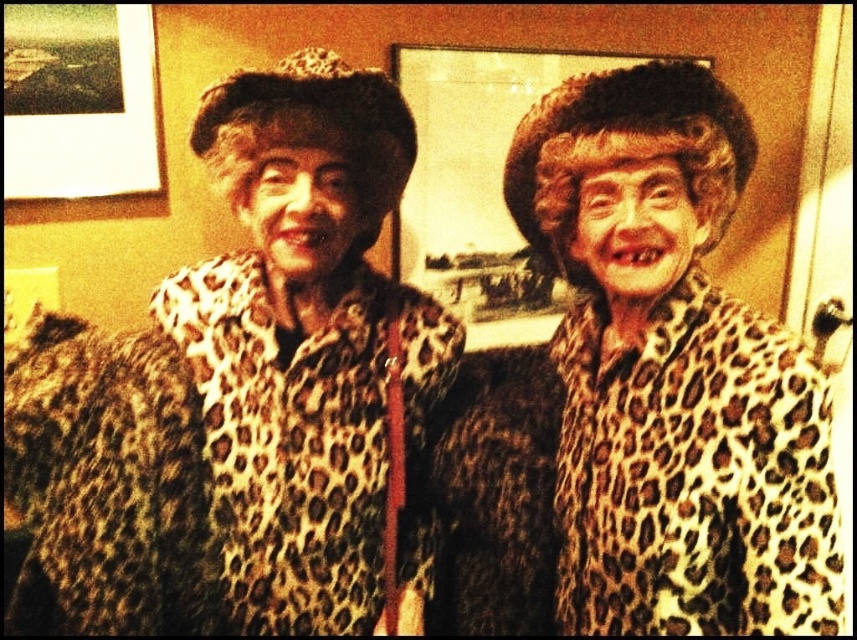
Does leopard print coat at center have a lesser width compared to matte plastic picture frame at upper center?

Indeed, leopard print coat at center has a lesser width compared to matte plastic picture frame at upper center.

Image resolution: width=857 pixels, height=640 pixels. What do you see at coordinates (670, 371) in the screenshot?
I see `leopard print coat at center` at bounding box center [670, 371].

What are the coordinates of `leopard print coat at center` in the screenshot? It's located at (670, 371).

Does point (579, 435) lie behind point (351, 477)?

Yes, it is.

Can you confirm if leopard print coat at center is wider than leopard print fur coat at center?

No, leopard print coat at center is not wider than leopard print fur coat at center.

Where is `leopard print coat at center`? This screenshot has width=857, height=640. leopard print coat at center is located at coordinates (670, 371).

Is the position of leopard print fur coat at center less distant than that of matte plastic picture frame at upper center?

Yes, leopard print fur coat at center is in front of matte plastic picture frame at upper center.

Is point (336, 625) less distant than point (501, 236)?

Yes, point (336, 625) is closer to viewer.

Locate an element on the screen. leopard print fur coat at center is located at coordinates (303, 435).